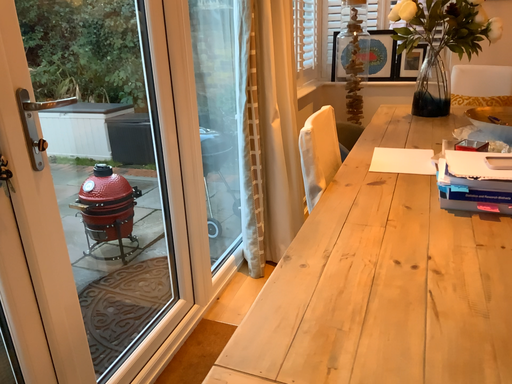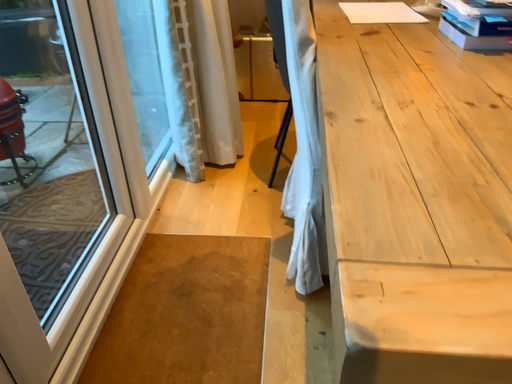
Question: Which way did the camera rotate in the video?

Choices:
 (A) rotated downward
 (B) rotated upward

Answer: (A)